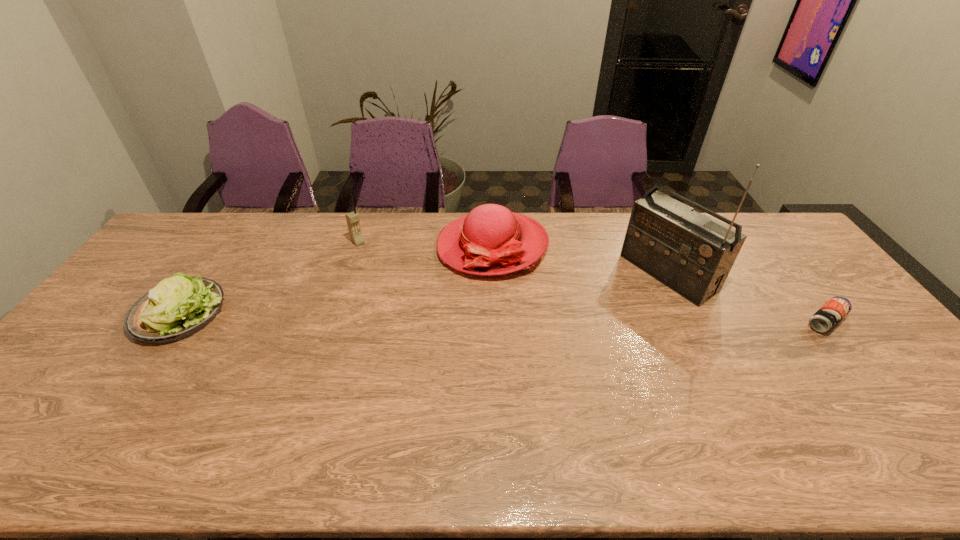
Where is `free space on the desktop that is between the second shortest object and the rightmost object and is positioned on the front panel of the radio receiver`? This screenshot has width=960, height=540. free space on the desktop that is between the second shortest object and the rightmost object and is positioned on the front panel of the radio receiver is located at coordinates (596, 318).

Locate an element on the screen. The width and height of the screenshot is (960, 540). free spot on the desktop that is between the second shortest object and the rightmost object and is positioned at the front of the third object from right to left with a bow is located at coordinates (407, 315).

At what (x,y) coordinates should I click in order to perform the action: click on free space on the desktop that is between the second shortest object and the shortest object and is positioned on the front of the second tallest object, where the keypad is located. Please return your answer as a coordinate pair (x, y). The image size is (960, 540). Looking at the image, I should click on (437, 316).